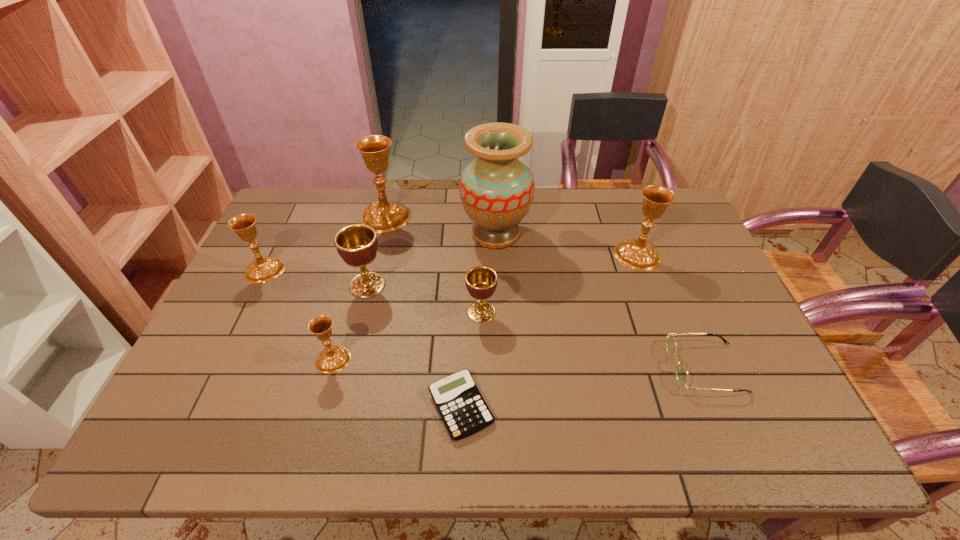
Find the location of a particular element. The width and height of the screenshot is (960, 540). free area in between the leftmost object and the farthest chalice is located at coordinates (325, 244).

This screenshot has height=540, width=960. I want to click on free spot between the bigger golden chalice and the tallest object, so click(431, 260).

Find the location of `free area in between the fourth nearest object and the smallest gold chalice`. free area in between the fourth nearest object and the smallest gold chalice is located at coordinates coord(407,336).

The image size is (960, 540). Identify the location of unoccupied area between the fifth farthest chalice and the eighth tallest object. (593, 340).

What are the coordinates of `vacant region between the right golden chalice and the spectacles` in the screenshot? It's located at (593, 340).

Locate which object ranks sixth in proximity to the left golden chalice. Please provide its 2D coordinates. Your answer should be formatted as a tuple, i.e. [(x, y)], where the tuple contains the x and y coordinates of a point satisfying the conditions above.

[(460, 404)]

Select which object appears as the closest to the bigger golden chalice. Please provide its 2D coordinates. Your answer should be formatted as a tuple, i.e. [(x, y)], where the tuple contains the x and y coordinates of a point satisfying the conditions above.

[(334, 358)]

The width and height of the screenshot is (960, 540). Identify the location of chalice that is the third closest to the farthest gold chalice. (481, 281).

Where is `chalice that is the second closest one to the second shortest object`? The width and height of the screenshot is (960, 540). chalice that is the second closest one to the second shortest object is located at coordinates (481, 281).

Locate which gold chalice ranks in proximity to the smallest gold chalice. Please provide its 2D coordinates. Your answer should be formatted as a tuple, i.e. [(x, y)], where the tuple contains the x and y coordinates of a point satisfying the conditions above.

[(262, 269)]